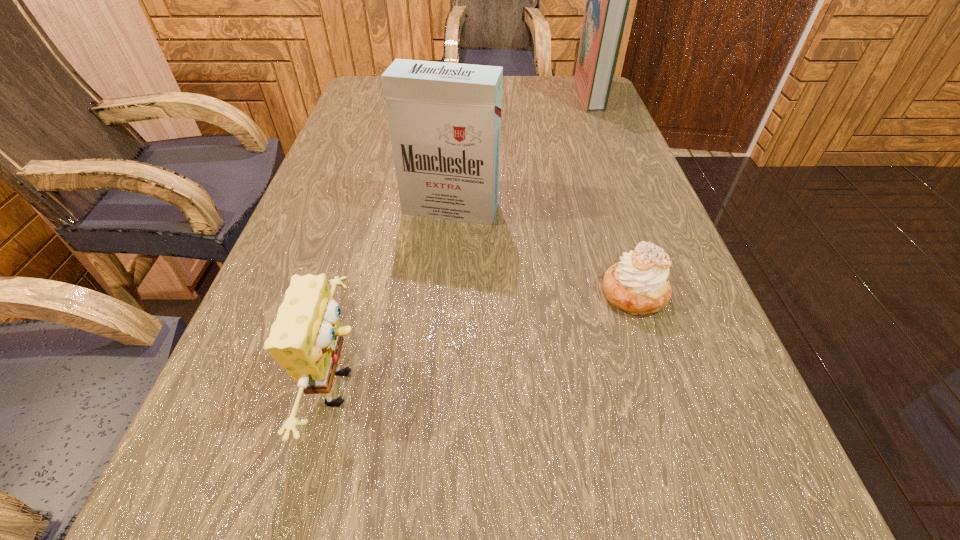
At what (x,y) coordinates should I click in order to perform the action: click on hardback book. Please return your answer as a coordinate pair (x, y). This screenshot has width=960, height=540. Looking at the image, I should click on (607, 0).

Where is `the farthest object`? The height and width of the screenshot is (540, 960). the farthest object is located at coordinates (607, 0).

At what (x,y) coordinates should I click in order to perform the action: click on cigarette case. Please return your answer as a coordinate pair (x, y). The height and width of the screenshot is (540, 960). Looking at the image, I should click on (444, 119).

At what (x,y) coordinates should I click in order to perform the action: click on the second farthest object. Please return your answer as a coordinate pair (x, y). This screenshot has height=540, width=960. Looking at the image, I should click on (444, 119).

At what (x,y) coordinates should I click in order to perform the action: click on the third tallest object. Please return your answer as a coordinate pair (x, y). Looking at the image, I should click on (x=306, y=339).

At what (x,y) coordinates should I click in order to perform the action: click on the nearest object. Please return your answer as a coordinate pair (x, y). The height and width of the screenshot is (540, 960). Looking at the image, I should click on (306, 339).

The image size is (960, 540). Find the location of `pastry`. pastry is located at coordinates (639, 284).

Image resolution: width=960 pixels, height=540 pixels. What are the coordinates of `the shortest object` in the screenshot? It's located at (639, 284).

Locate an element on the screen. This screenshot has width=960, height=540. free point located 0.310m on the cover of the tallest object is located at coordinates (474, 93).

Identify the location of vacant space located 0.320m on the cover of the tallest object. This screenshot has width=960, height=540. (471, 93).